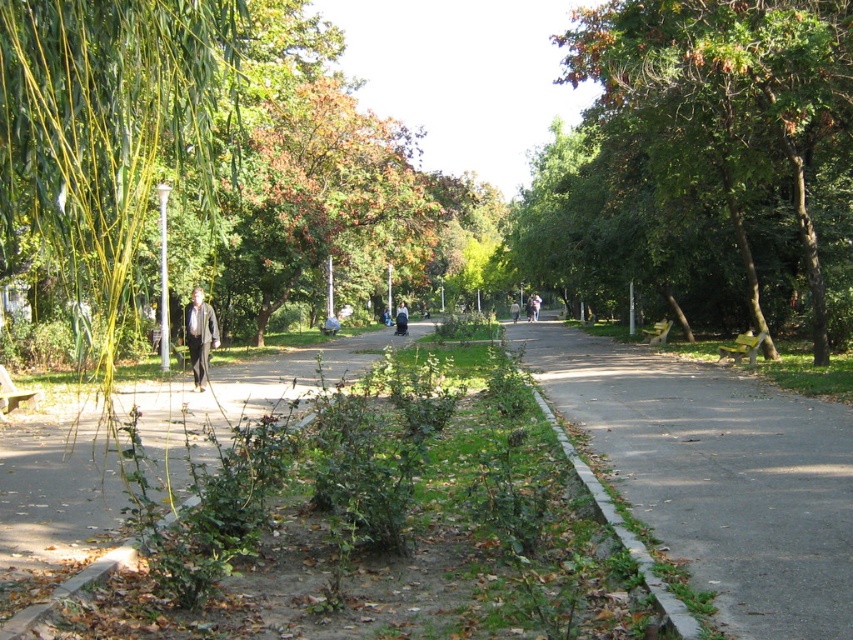
You are a photographer standing at the park entrance and want to take a photo of the gray asphalt pavement at center and the light brown leather jacket at center. Based on their positions, which object should you adjust your camera to focus on first to ensure both are in the frame?

The gray asphalt pavement at center is positioned on the right side of light brown leather jacket at center, so you should focus on the light brown leather jacket at center first to ensure both are in the frame.

You are standing at the park entrance and see the gray asphalt pavement at center and the light brown leather jacket at center. Which object is nearer to you?

The gray asphalt pavement at center is closer to the viewer than the light brown leather jacket at center.

You are standing at the entrance of the park and see the brown asphalt path at center and the dark gray sweater at center. Which object is closer to you?

The brown asphalt path at center is shorter than the dark gray sweater at center, so it is closer to you.